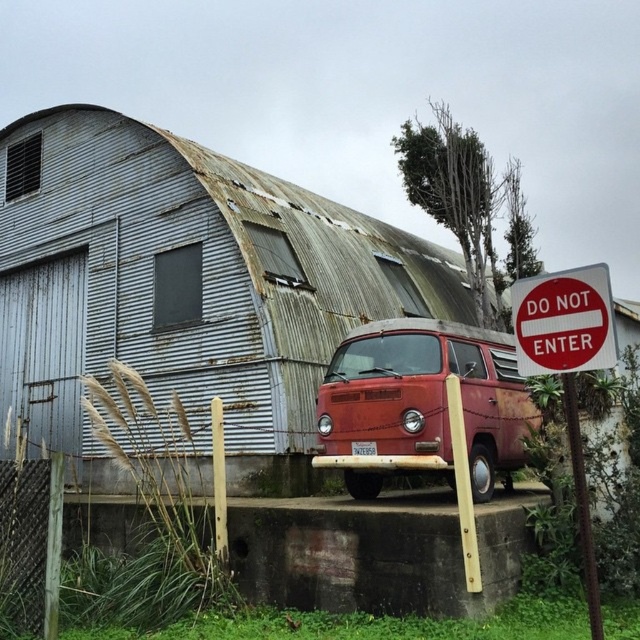
Question: Which point is closer to the camera?

Choices:
 (A) (596, 326)
 (B) (488, 477)
 (C) (552, 280)
 (D) (240, 312)

Answer: (A)

Question: Does rusty corrugated metal barn at center appear on the left side of red plastic sign at right?

Choices:
 (A) yes
 (B) no

Answer: (A)

Question: Which object is the closest to the red plastic sign at right?

Choices:
 (A) rusty metal van at center
 (B) rusty corrugated metal barn at center
 (C) red plastic sign at upper right

Answer: (C)

Question: Does rusty corrugated metal barn at center have a greater width compared to red plastic sign at upper right?

Choices:
 (A) no
 (B) yes

Answer: (B)

Question: Does rusty metal van at center appear under red plastic sign at right?

Choices:
 (A) no
 (B) yes

Answer: (A)

Question: Considering the real-world distances, which object is closest to the red plastic sign at upper right?

Choices:
 (A) red plastic sign at right
 (B) rusty metal van at center
 (C) rusty corrugated metal barn at center

Answer: (A)